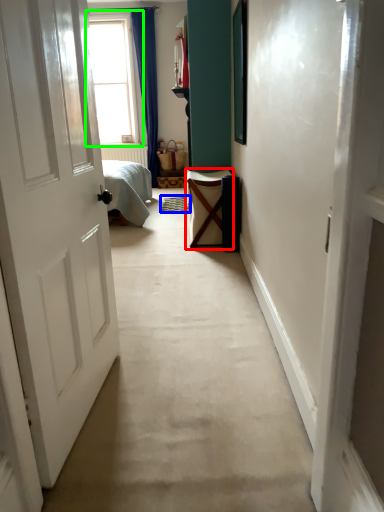
Question: Which is nearer to the furniture (highlighted by a red box)? doormat (highlighted by a blue box) or window (highlighted by a green box).

Choices:
 (A) doormat
 (B) window

Answer: (A)